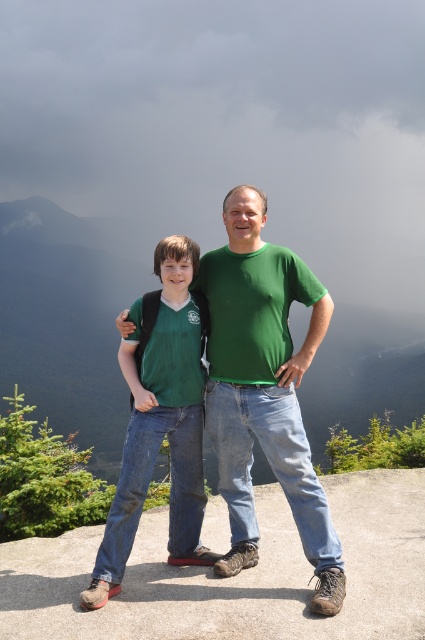
Question: Which point appears farthest from the camera in this image?

Choices:
 (A) (95, 582)
 (B) (311, 536)

Answer: (B)

Question: Which point is farther to the camera?

Choices:
 (A) (254, 381)
 (B) (189, 525)

Answer: (B)

Question: Which object appears farthest from the camera in this image?

Choices:
 (A) matte green shirt at center
 (B) green matte t-shirt at center

Answer: (A)

Question: Does green matte t-shirt at center appear over matte green shirt at center?

Choices:
 (A) no
 (B) yes

Answer: (B)

Question: Is green matte t-shirt at center bigger than matte green shirt at center?

Choices:
 (A) no
 (B) yes

Answer: (B)

Question: Does green matte t-shirt at center have a lesser width compared to matte green shirt at center?

Choices:
 (A) no
 (B) yes

Answer: (A)